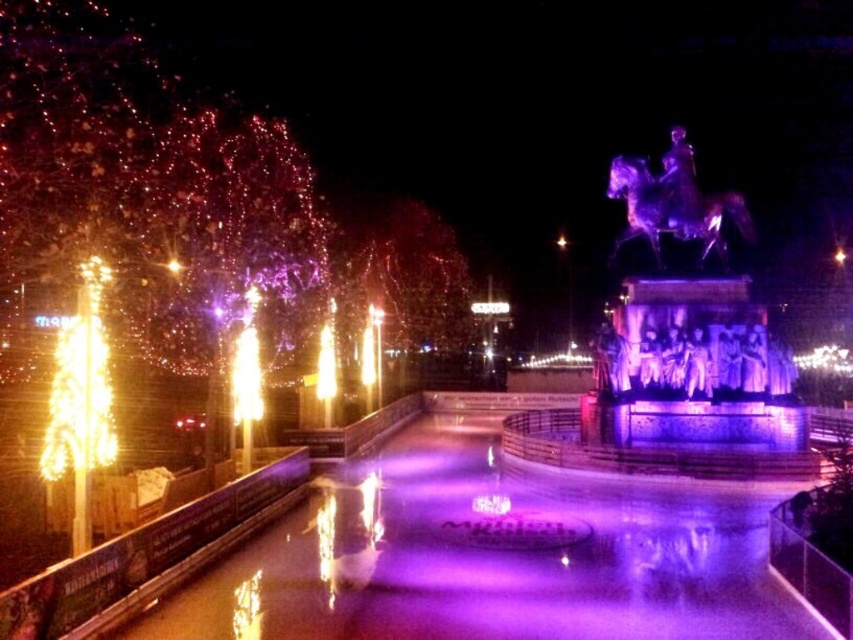
Question: Can you confirm if purple glossy statue at center is positioned to the left of metallic statue at upper right?

Choices:
 (A) yes
 (B) no

Answer: (A)

Question: Which of the following is the farthest from the observer?

Choices:
 (A) (662, 205)
 (B) (753, 324)

Answer: (A)

Question: In this image, where is purple glossy statue at center located relative to metallic statue at upper right?

Choices:
 (A) below
 (B) above

Answer: (A)

Question: Which object is farther from the camera taking this photo?

Choices:
 (A) metallic statue at upper right
 (B) purple glossy statue at center

Answer: (A)

Question: In this image, where is purple glossy statue at center located relative to metallic statue at upper right?

Choices:
 (A) right
 (B) left

Answer: (B)